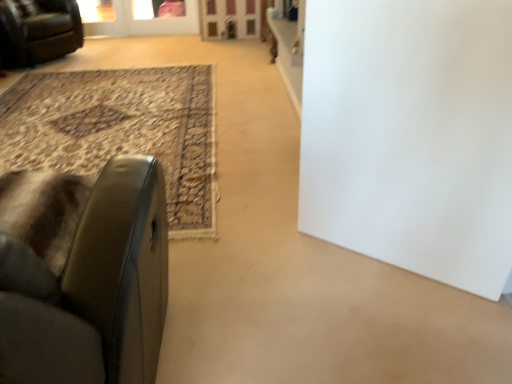
Question: Is there a large distance between leather at left, which appears as the second chair when viewed from the left, and wooden screen door at upper center, arranged as the 2th screen door when viewed from the left?

Choices:
 (A) no
 (B) yes

Answer: (B)

Question: Does leather at left, the 2th chair in the back-to-front sequence, lie behind wooden screen door at upper center, arranged as the 2th screen door when viewed from the left?

Choices:
 (A) no
 (B) yes

Answer: (A)

Question: From a real-world perspective, is leather at left, the 2th chair in the back-to-front sequence, beneath wooden screen door at upper center, arranged as the 2th screen door when viewed from the left?

Choices:
 (A) no
 (B) yes

Answer: (A)

Question: Can you confirm if leather at left, the first chair viewed from the right, is smaller than wooden screen door at upper center, arranged as the 2th screen door when viewed from the left?

Choices:
 (A) yes
 (B) no

Answer: (B)

Question: From the image's perspective, is leather at left, the 2th chair in the back-to-front sequence, over wooden screen door at upper center, the 1th screen door when ordered from right to left?

Choices:
 (A) no
 (B) yes

Answer: (A)

Question: Choose the correct answer: Is leather at left, the first chair viewed from the right, inside wooden screen door at upper center, arranged as the 2th screen door when viewed from the left, or outside it?

Choices:
 (A) inside
 (B) outside

Answer: (B)

Question: In terms of size, does leather at left, the 1th chair from the bottom, appear bigger or smaller than wooden screen door at upper center, arranged as the 2th screen door when viewed from the left?

Choices:
 (A) big
 (B) small

Answer: (A)

Question: Is leather at left, the 1th chair from the bottom, taller or shorter than wooden screen door at upper center, the 1th screen door when ordered from right to left?

Choices:
 (A) tall
 (B) short

Answer: (A)

Question: Is leather at left, the 1th chair from the bottom, wider or thinner than wooden screen door at upper center, the 1th screen door when ordered from right to left?

Choices:
 (A) wide
 (B) thin

Answer: (A)

Question: From a real-world perspective, relative to wooden screen door at upper center, arranged as the 2th screen door when viewed from the left, is transparent glass screen door at upper center, positioned as the 2th screen door in right-to-left order, vertically above or below?

Choices:
 (A) above
 (B) below

Answer: (B)

Question: In terms of width, does transparent glass screen door at upper center, positioned as the 2th screen door in right-to-left order, look wider or thinner when compared to wooden screen door at upper center, arranged as the 2th screen door when viewed from the left?

Choices:
 (A) thin
 (B) wide

Answer: (A)

Question: Looking at the image, does transparent glass screen door at upper center, marked as the 1th screen door in a left-to-right arrangement, seem bigger or smaller compared to wooden screen door at upper center, the 1th screen door when ordered from right to left?

Choices:
 (A) big
 (B) small

Answer: (B)

Question: Relative to wooden screen door at upper center, arranged as the 2th screen door when viewed from the left, is transparent glass screen door at upper center, positioned as the 2th screen door in right-to-left order, in front or behind?

Choices:
 (A) behind
 (B) front

Answer: (A)

Question: Looking at their shapes, would you say leather at left, the 1th chair from the bottom, is wider or thinner than transparent glass screen door at upper center, positioned as the 2th screen door in right-to-left order?

Choices:
 (A) thin
 (B) wide

Answer: (B)

Question: In the image, is leather at left, the 1th chair from the bottom, positioned in front of or behind transparent glass screen door at upper center, positioned as the 2th screen door in right-to-left order?

Choices:
 (A) front
 (B) behind

Answer: (A)